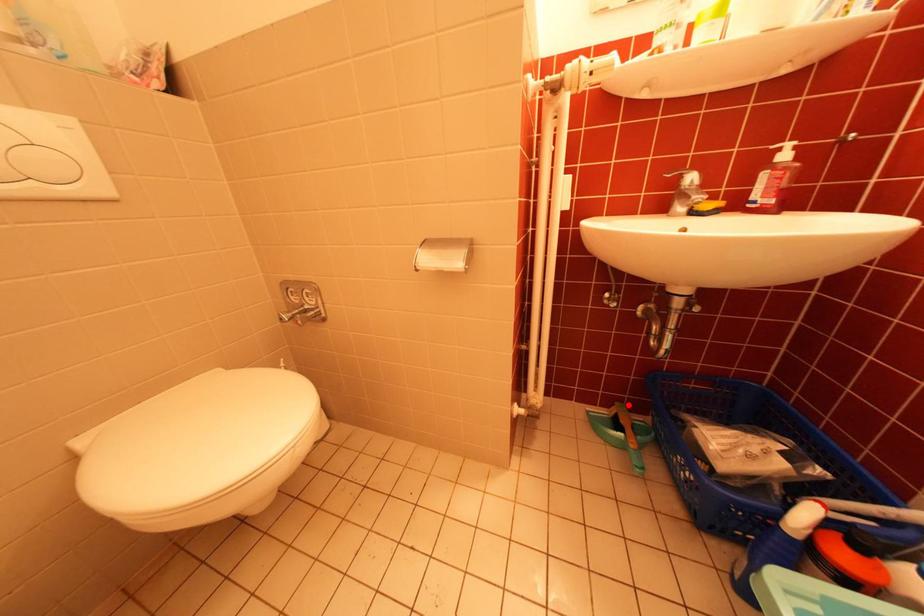
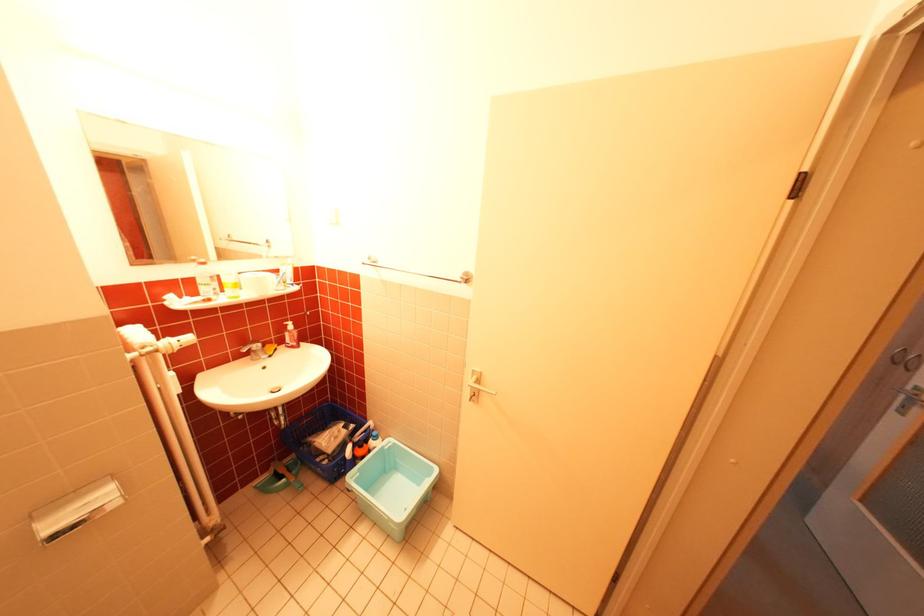
Locate, in the second image, the point that corresponds to the highlighted location in the first image.

(283, 464)